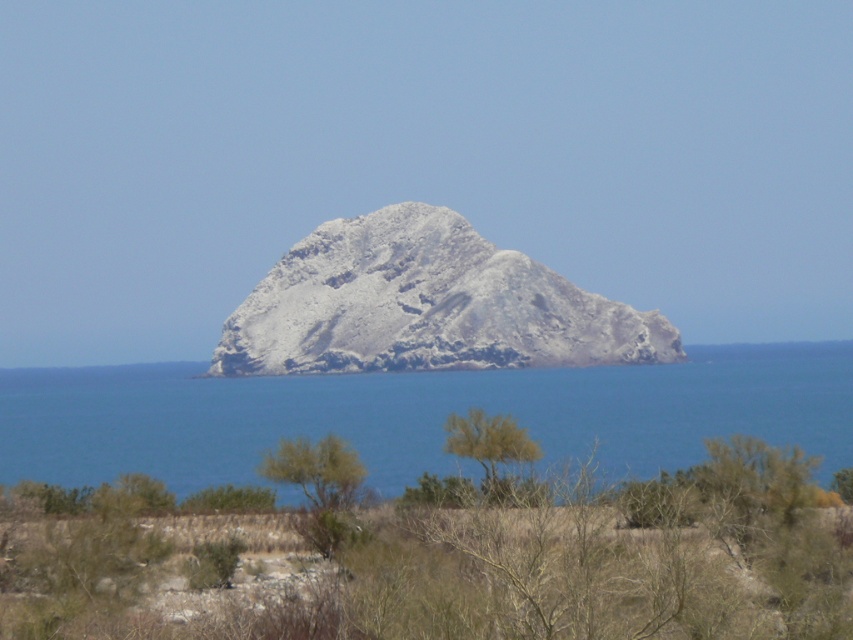
Question: Can you confirm if blue water at center is positioned below gray rocky mountain at center?

Choices:
 (A) no
 (B) yes

Answer: (B)

Question: Which object is positioned closest to the green leafy tree at center?

Choices:
 (A) blue water at center
 (B) gray rocky mountain at center
 (C) green leafy shrub at center

Answer: (C)

Question: Which of the following is the farthest from the observer?

Choices:
 (A) gray rocky mountain at center
 (B) green leafy shrub at center
 (C) green leafy tree at center

Answer: (A)

Question: Observing the image, what is the correct spatial positioning of blue water at center in reference to gray rocky mountain at center?

Choices:
 (A) below
 (B) above

Answer: (A)

Question: Does blue water at center appear on the right side of gray rocky mountain at center?

Choices:
 (A) yes
 (B) no

Answer: (A)

Question: Which point is farther from the camera taking this photo?

Choices:
 (A) (474, 339)
 (B) (268, 465)
 (C) (538, 422)

Answer: (A)